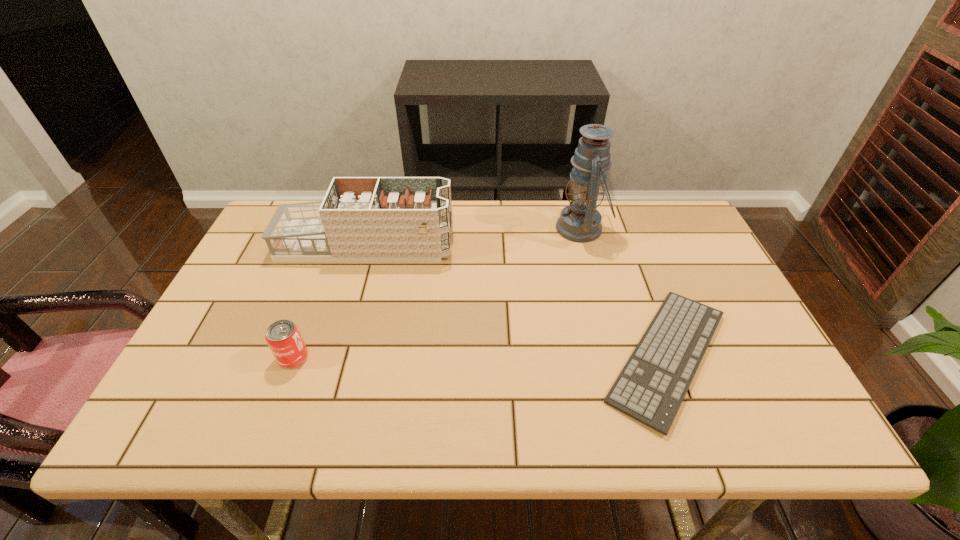
I want to click on lantern, so click(580, 222).

Identify the location of the second tallest object. (360, 218).

You are a GUI agent. You are given a task and a screenshot of the screen. Output one action in this format:
    pyautogui.click(x=<x>, y=<y>)
    Task: Click on the third tallest object
    This screenshot has height=540, width=960.
    Given the screenshot: What is the action you would take?
    pyautogui.click(x=283, y=337)

Locate an element on the screen. This screenshot has height=540, width=960. computer keyboard is located at coordinates (651, 387).

At what (x,y) coordinates should I click in order to perform the action: click on blank space located on the front-facing side of the lantern. Please return your answer as a coordinate pair (x, y). This screenshot has width=960, height=540. Looking at the image, I should click on (460, 228).

The width and height of the screenshot is (960, 540). In order to click on free space located on the front-facing side of the lantern in this screenshot , I will do `click(494, 228)`.

The image size is (960, 540). What are the coordinates of `free space located 0.170m on the front-facing side of the lantern` in the screenshot? It's located at (501, 228).

Locate an element on the screen. The width and height of the screenshot is (960, 540). free space located at the entrance of the third shortest object is located at coordinates (489, 245).

At what (x,y) coordinates should I click in order to perform the action: click on blank area located 0.400m on the right of the second shortest object. Please return your answer as a coordinate pair (x, y). Image resolution: width=960 pixels, height=540 pixels. Looking at the image, I should click on pos(480,357).

The height and width of the screenshot is (540, 960). I want to click on blank space located on the back of the shortest object, so click(625, 241).